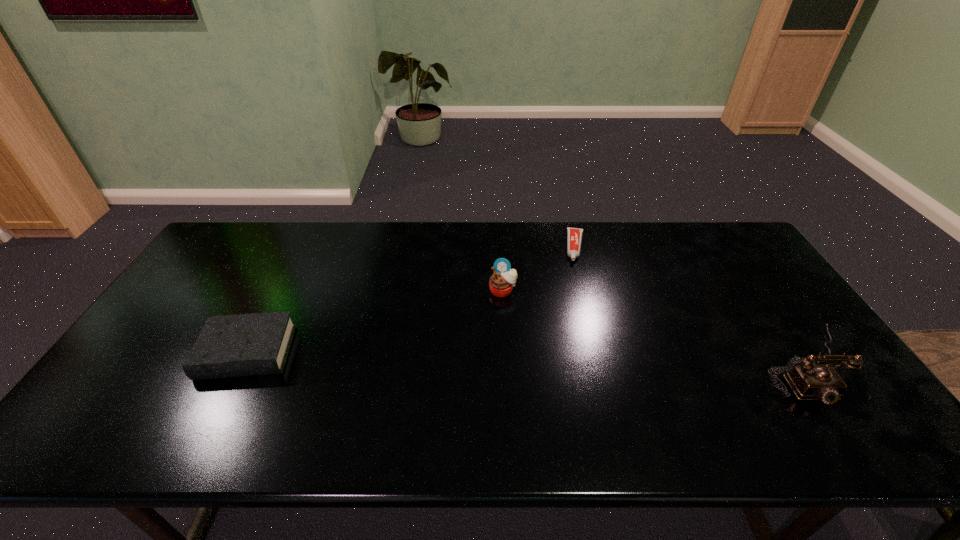
Identify the location of vacant area located 0.330m at the nozzle of the toothpaste. (574, 339).

Where is `blank space located 0.210m on the front-facing side of the third nearest object`? Image resolution: width=960 pixels, height=540 pixels. blank space located 0.210m on the front-facing side of the third nearest object is located at coordinates (501, 354).

Where is `vacant space located 0.340m on the front-facing side of the third nearest object`? The height and width of the screenshot is (540, 960). vacant space located 0.340m on the front-facing side of the third nearest object is located at coordinates (500, 396).

This screenshot has width=960, height=540. I want to click on vacant space situated 0.050m on the front-facing side of the third nearest object, so click(502, 311).

You are a GUI agent. You are given a task and a screenshot of the screen. Output one action in this format:
    pyautogui.click(x=<x>, y=<y>)
    Task: Click on the object located in the far edge section of the desktop
    
    Given the screenshot: What is the action you would take?
    pyautogui.click(x=574, y=235)

Locate an element on the screen. The height and width of the screenshot is (540, 960). Bible at the near edge is located at coordinates (252, 344).

The width and height of the screenshot is (960, 540). I want to click on telephone that is at the near edge, so click(x=809, y=381).

Image resolution: width=960 pixels, height=540 pixels. Identify the location of object present at the right edge. (809, 381).

The image size is (960, 540). I want to click on object present at the near right corner, so click(x=809, y=381).

Where is `vacant space at the far edge`? This screenshot has height=540, width=960. vacant space at the far edge is located at coordinates tap(653, 228).